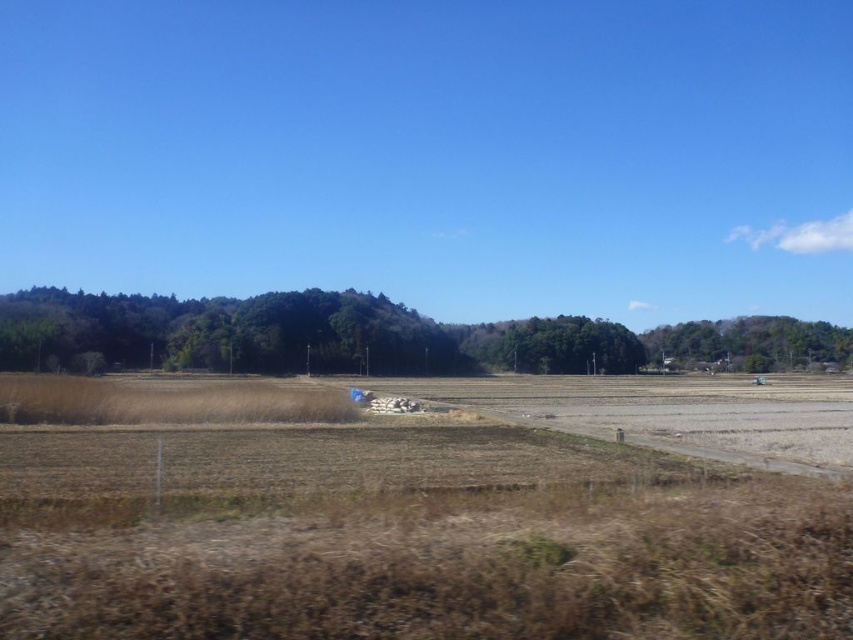
You are standing at the edge of the dry field and want to walk to the forest area behind the trees. Which direction should you head relative to the brown dry grass at center and the green leafy trees at left?

The brown dry grass at center is positioned on the left side of green leafy trees at left, so to reach the forest area behind the trees, you should head to the right of the green leafy trees at left.

You are standing at the edge of the dry field in the rural landscape. You notice two points marked on the ground. The first point is at coordinates point (810, 468) and the second point is at coordinates point (691, 323). Which point is closer to you?

Point (810, 468) is in front of point (691, 323), so the first point is closer to you.

You are standing at the center of the dry, brown field in the foreground of the image. You want to walk directly towards the green leafy tree at right. In which direction should you head?

You should head towards the right direction since the green leafy tree at right is located at the right side of the image.